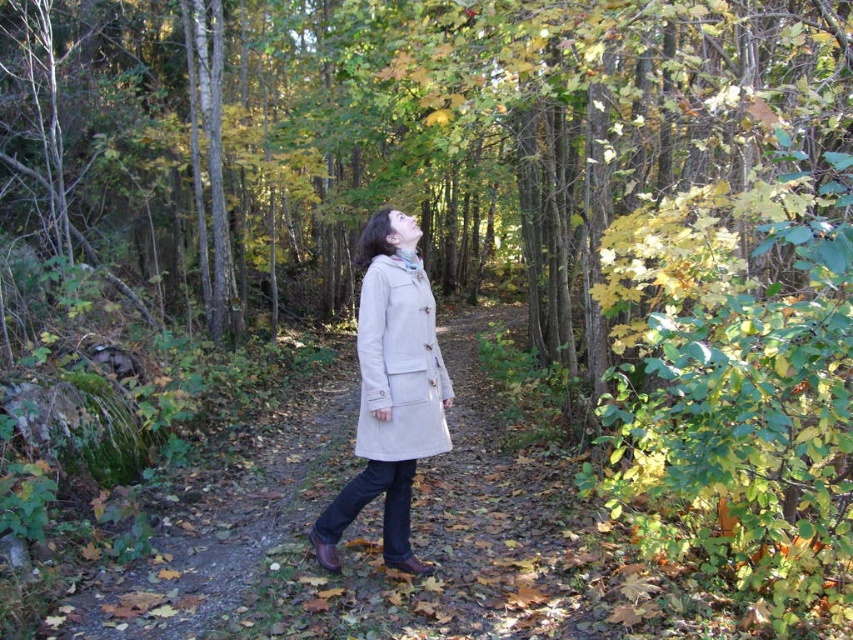
Which of these two, beige wool coat at center or beige cotton trench coat at center, stands taller?

With more height is beige wool coat at center.

Between beige wool coat at center and beige cotton trench coat at center, which one is positioned higher?

beige cotton trench coat at center is higher up.

Identify the location of beige wool coat at center. This screenshot has height=640, width=853. (392, 388).

The image size is (853, 640). In order to click on beige wool coat at center in this screenshot , I will do `click(392, 388)`.

Which of these two, light beige fabric path at center or beige wool coat at center, stands shorter?

light beige fabric path at center

Does light beige fabric path at center have a greater height compared to beige wool coat at center?

No.

Who is more distant from viewer, (83, 632) or (328, 548)?

Positioned behind is point (328, 548).

Where is `light beige fabric path at center`? light beige fabric path at center is located at coordinates (369, 541).

Is light beige fabric path at center below beige cotton trench coat at center?

Yes.

Can you confirm if light beige fabric path at center is thinner than beige cotton trench coat at center?

Incorrect, light beige fabric path at center's width is not less than beige cotton trench coat at center's.

Between point (550, 477) and point (422, 324), which one is positioned in front?

Point (422, 324) is more forward.

The width and height of the screenshot is (853, 640). Identify the location of light beige fabric path at center. (369, 541).